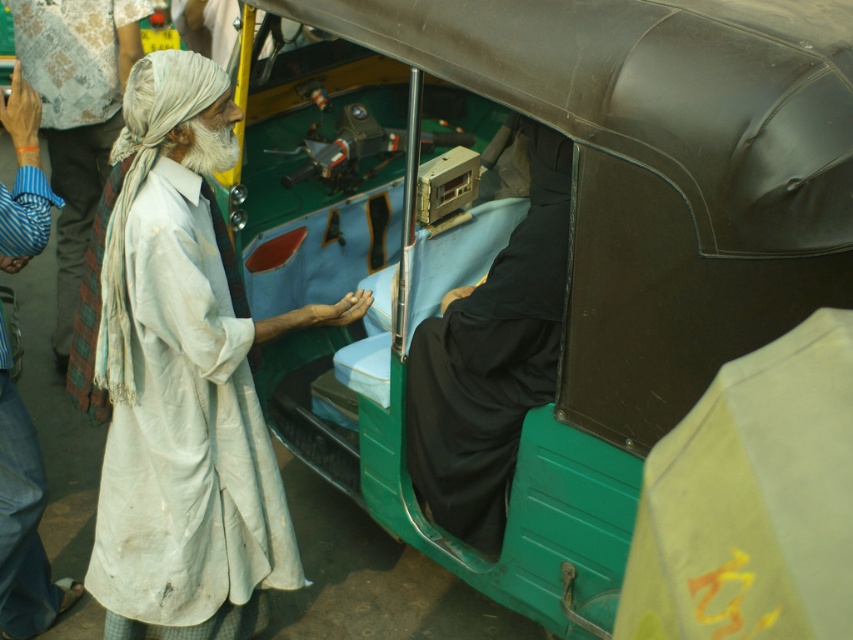
You are standing at the point with coordinates point (x=425, y=476) and want to walk to the point with coordinates point (x=225, y=500). Which direction should you move in?

You should move forward because point (x=225, y=500) is in front of point (x=425, y=476).

You are a pedestrian standing on the sidewalk and see the green plastic motor vehicle at center and the white cloth at left. Which object is higher in position?

The green plastic motor vehicle at center is located above the white cloth at left, so it is higher in position.

You are standing at the point marked as point (421, 330) in the image, which is 11.25 feet away from the camera. If you want to approach the rickshaw driver inside the vibrant green rickshaw with black canopy, can you walk directly towards the rickshaw without any obstacles?

Yes, since the point (421, 330) is 11.25 feet away from the camera and there are no obstacles mentioned between you and the rickshaw, you can walk directly towards the vibrant green rickshaw with black canopy.